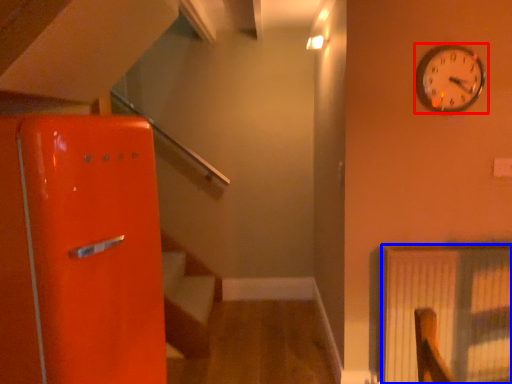
Question: Among these objects, which one is nearest to the camera, wall clock (highlighted by a red box) or radiator (highlighted by a blue box)?

Choices:
 (A) wall clock
 (B) radiator

Answer: (A)